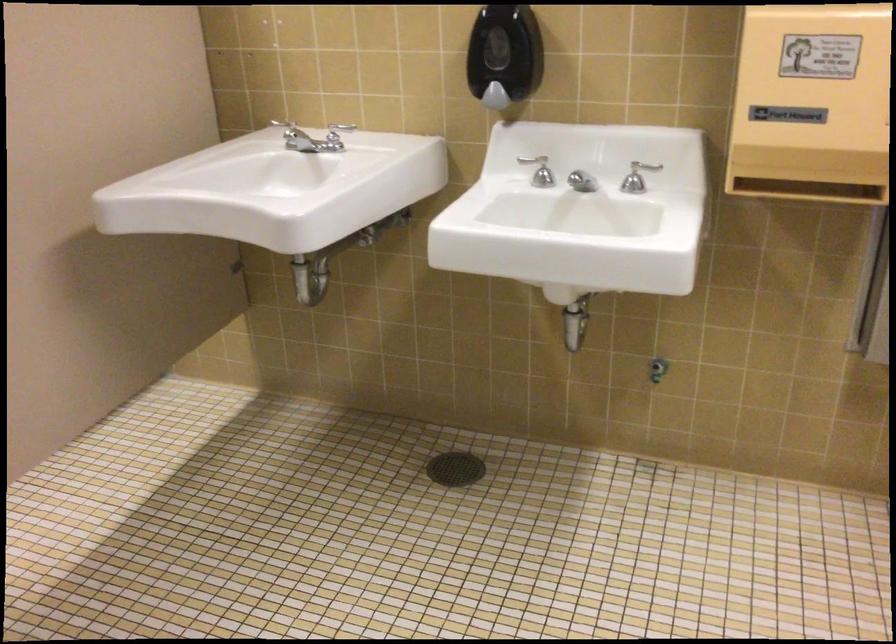
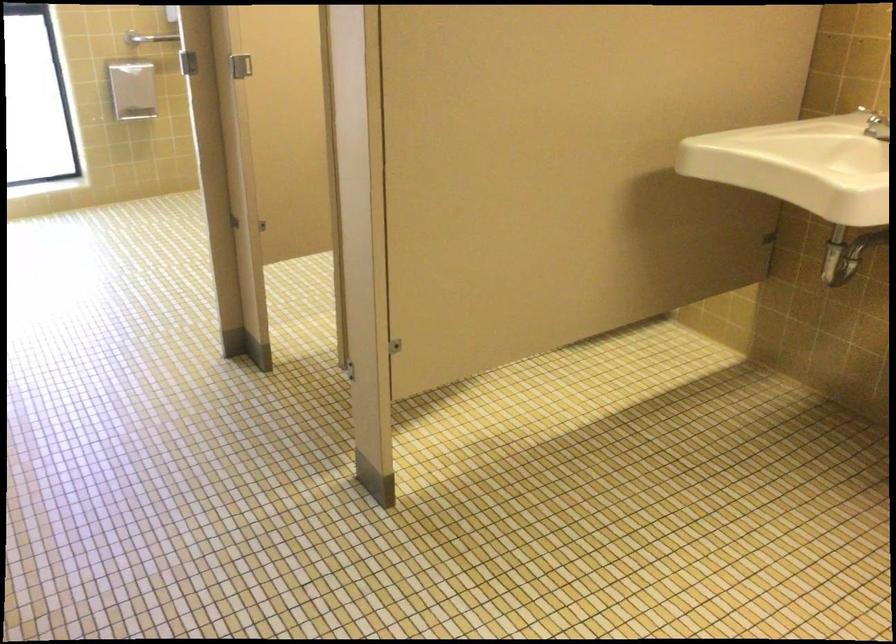
Question: The images are taken continuously from a first-person perspective. In which direction is your viewpoint rotating?

Choices:
 (A) Left
 (B) Right
 (C) Up
 (D) Down

Answer: (A)